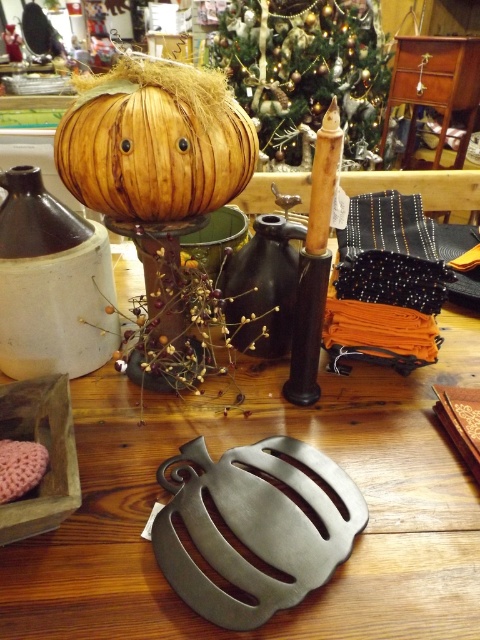
Who is positioned more to the left, metallic gray trivet at center or wooden pumpkin at center?

Positioned to the left is wooden pumpkin at center.

Does metallic gray trivet at center have a greater height compared to wooden pumpkin at center?

Indeed, metallic gray trivet at center has a greater height compared to wooden pumpkin at center.

At what (x,y) coordinates should I click in order to perform the action: click on metallic gray trivet at center. Please return your answer as a coordinate pair (x, y). The width and height of the screenshot is (480, 640). Looking at the image, I should click on (247, 444).